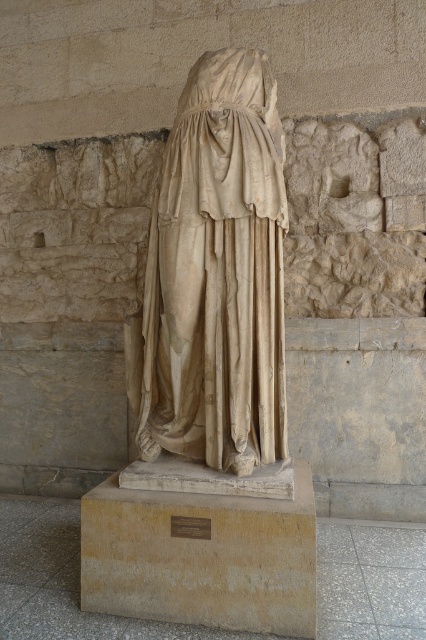
You are a museum security guard checking the layout of the exhibit. You need to ensure that the beige stone statue at center is placed correctly according to the museum guidelines, which state that the statue must be centered on the beige stone pedestal at center. Based on the image, is the statue properly positioned?

The beige stone statue at center is positioned on the right side of the beige stone pedestal at center, so it is not centered and therefore not properly positioned according to the museum guidelines.

You are standing in front of the ancient marble statue and want to determine the position of two points on the statue. The first point is at coordinates point (210, 381) and the second point is at point (134, 563). Which point is closer to you?

Point (210, 381) is further to the camera than point (134, 563), so the point closer to you is point (134, 563).

You are standing in a museum and see the beige stone statue at center. If you were to draw a dot exactly where the statue is located on a grid from 0 to 1 in both x and y directions, what would be the coordinates of that dot?

The coordinates of the beige stone statue at center are at point [215,276].